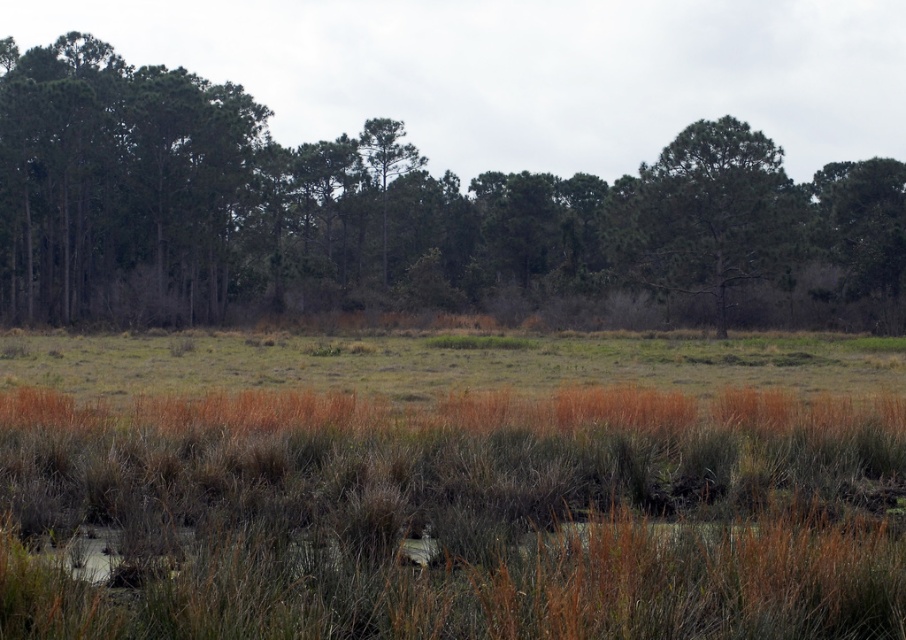
Question: Which point is closer to the camera?

Choices:
 (A) (675, 244)
 (B) (466, 264)
 (C) (879, 248)

Answer: (A)

Question: Does green leafy tree at center have a larger size compared to green leafy tree at upper right?

Choices:
 (A) no
 (B) yes

Answer: (B)

Question: Among these points, which one is farthest from the camera?

Choices:
 (A) (744, 204)
 (B) (870, 220)

Answer: (B)

Question: Is green leafy tree at center below green leafy tree at upper right?

Choices:
 (A) yes
 (B) no

Answer: (B)

Question: Which is farther from the green leafy tree at center?

Choices:
 (A) green leafy tree at upper right
 (B) green matte tree at upper right

Answer: (A)

Question: Considering the relative positions of green leafy tree at center and green matte tree at upper right in the image provided, where is green leafy tree at center located with respect to green matte tree at upper right?

Choices:
 (A) below
 (B) above

Answer: (B)